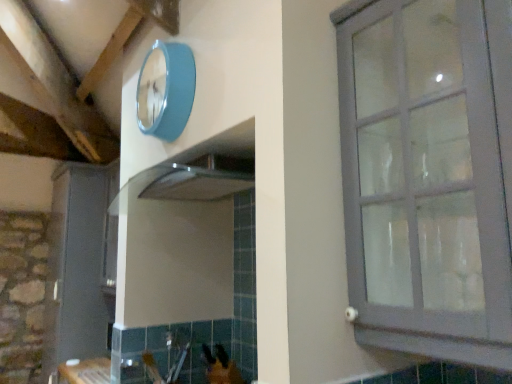
Question: From a real-world perspective, is teal glossy clock at upper center physically below matte gray cabinet at right?

Choices:
 (A) yes
 (B) no

Answer: (B)

Question: Is matte gray cabinet at right surrounded by teal glossy clock at upper center?

Choices:
 (A) yes
 (B) no

Answer: (B)

Question: From a real-world perspective, does teal glossy clock at upper center stand above matte gray cabinet at right?

Choices:
 (A) no
 (B) yes

Answer: (B)

Question: Considering the relative sizes of teal glossy clock at upper center and matte gray cabinet at right in the image provided, is teal glossy clock at upper center wider than matte gray cabinet at right?

Choices:
 (A) no
 (B) yes

Answer: (A)

Question: Can you confirm if teal glossy clock at upper center is positioned to the left of matte gray cabinet at right?

Choices:
 (A) yes
 (B) no

Answer: (A)

Question: From a real-world perspective, is matte gray cabinet at right above or below teal glossy clock at upper center?

Choices:
 (A) below
 (B) above

Answer: (A)

Question: Is point (454, 344) closer or farther from the camera than point (195, 72)?

Choices:
 (A) closer
 (B) farther

Answer: (A)

Question: Considering the positions of matte gray cabinet at right and teal glossy clock at upper center in the image, is matte gray cabinet at right wider or thinner than teal glossy clock at upper center?

Choices:
 (A) thin
 (B) wide

Answer: (B)

Question: In terms of height, does matte gray cabinet at right look taller or shorter compared to teal glossy clock at upper center?

Choices:
 (A) short
 (B) tall

Answer: (B)

Question: Would you say matte gray cabinet at left is to the left or to the right of teal glossy clock at upper center in the picture?

Choices:
 (A) right
 (B) left

Answer: (B)

Question: Do you think matte gray cabinet at left is within teal glossy clock at upper center, or outside of it?

Choices:
 (A) inside
 (B) outside

Answer: (B)

Question: Relative to teal glossy clock at upper center, is matte gray cabinet at left in front or behind?

Choices:
 (A) behind
 (B) front

Answer: (A)

Question: Looking at the image, does matte gray cabinet at left seem bigger or smaller compared to teal glossy clock at upper center?

Choices:
 (A) big
 (B) small

Answer: (A)

Question: Is matte gray cabinet at right in front of or behind matte gray cabinet at left in the image?

Choices:
 (A) front
 (B) behind

Answer: (A)

Question: Is matte gray cabinet at right bigger or smaller than matte gray cabinet at left?

Choices:
 (A) small
 (B) big

Answer: (A)